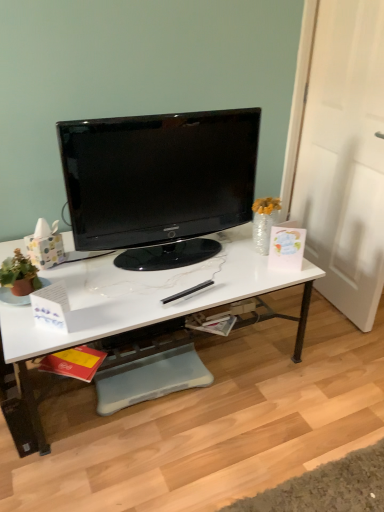
Question: Considering the positions of point (77, 139) and point (258, 290), is point (77, 139) closer or farther from the camera than point (258, 290)?

Choices:
 (A) closer
 (B) farther

Answer: (A)

Question: From a real-world perspective, is black glossy television at center positioned above or below white marble desk at center?

Choices:
 (A) below
 (B) above

Answer: (B)

Question: Is black glossy television at center wider or thinner than white marble desk at center?

Choices:
 (A) thin
 (B) wide

Answer: (A)

Question: Looking at their shapes, would you say white marble desk at center is wider or thinner than black glossy television at center?

Choices:
 (A) wide
 (B) thin

Answer: (A)

Question: From a real-world perspective, is white marble desk at center above or below black glossy television at center?

Choices:
 (A) above
 (B) below

Answer: (B)

Question: Is white marble desk at center spatially inside black glossy television at center, or outside of it?

Choices:
 (A) outside
 (B) inside

Answer: (A)

Question: Considering the positions of point (238, 266) and point (185, 221), is point (238, 266) closer or farther from the camera than point (185, 221)?

Choices:
 (A) closer
 (B) farther

Answer: (A)